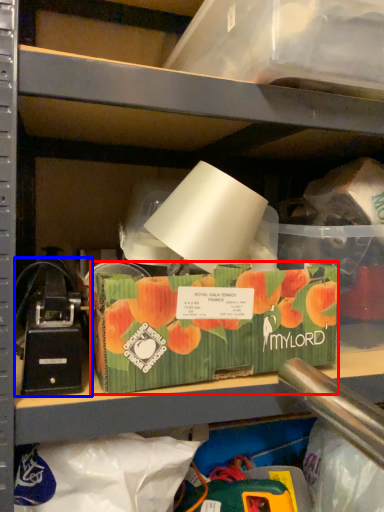
Question: Among these objects, which one is farthest to the camera, storage box (highlighted by a red box) or toy (highlighted by a blue box)?

Choices:
 (A) storage box
 (B) toy

Answer: (A)